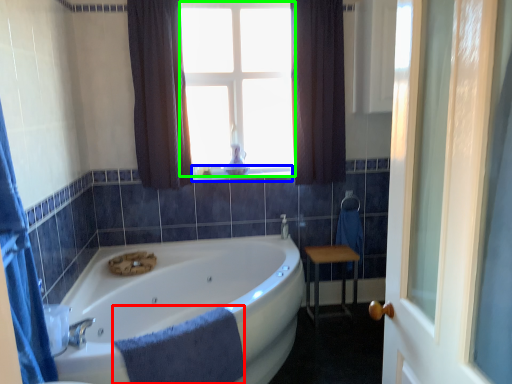
Question: Considering the real-world distances, which object is farthest from bath towel (highlighted by a red box)? window sill (highlighted by a blue box) or bay window (highlighted by a green box)?

Choices:
 (A) window sill
 (B) bay window

Answer: (B)